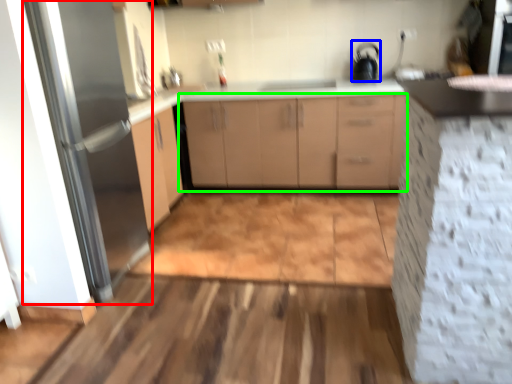
Question: Which object is the closest to the fridge (highlighted by a red box)? Choose among these: appliance (highlighted by a blue box) or cabinetry (highlighted by a green box).

Choices:
 (A) appliance
 (B) cabinetry

Answer: (B)